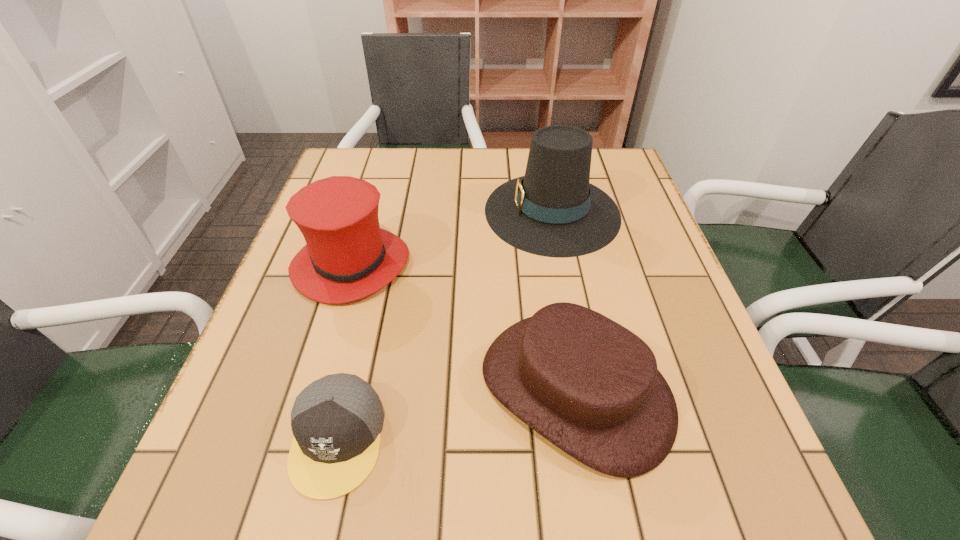
Where is `unoccupied area between the leftmost hat and the tallest object`? The height and width of the screenshot is (540, 960). unoccupied area between the leftmost hat and the tallest object is located at coordinates (452, 238).

This screenshot has width=960, height=540. Find the location of `vacant space that's between the shortest hat and the third shortest object`. vacant space that's between the shortest hat and the third shortest object is located at coordinates (464, 327).

You are a GUI agent. You are given a task and a screenshot of the screen. Output one action in this format:
    pyautogui.click(x=<x>, y=<y>)
    Task: Click on the empty location between the shortest object and the leftmost hat
    The height and width of the screenshot is (540, 960).
    Given the screenshot: What is the action you would take?
    pyautogui.click(x=345, y=352)

You are a GUI agent. You are given a task and a screenshot of the screen. Output one action in this format:
    pyautogui.click(x=<x>, y=<y>)
    Task: Click on the vacant space that is in between the shortest object and the second shortest object
    Image resolution: width=960 pixels, height=540 pixels.
    Given the screenshot: What is the action you would take?
    pyautogui.click(x=456, y=414)

Locate which object is the third closest to the second shortest object. Please provide its 2D coordinates. Your answer should be formatted as a tuple, i.e. [(x, y)], where the tuple contains the x and y coordinates of a point satisfying the conditions above.

[(553, 211)]

In order to click on object that is the second closest to the third shortest object in this screenshot , I will do `click(553, 211)`.

Identify which hat is the second nearest to the second tallest object. Please provide its 2D coordinates. Your answer should be formatted as a tuple, i.e. [(x, y)], where the tuple contains the x and y coordinates of a point satisfying the conditions above.

[(553, 211)]

I want to click on hat that is the second nearest to the shortest hat, so click(553, 211).

Where is `vacant region that satisfies the following two spatial constraints: 1. on the front-facing side of the tallest object; 2. on the front-facing side of the shortest object`? vacant region that satisfies the following two spatial constraints: 1. on the front-facing side of the tallest object; 2. on the front-facing side of the shortest object is located at coordinates (596, 439).

The height and width of the screenshot is (540, 960). In order to click on free point that satisfies the following two spatial constraints: 1. on the front-facing side of the tallest hat; 2. on the front-facing side of the shortest object in this screenshot , I will do [596, 439].